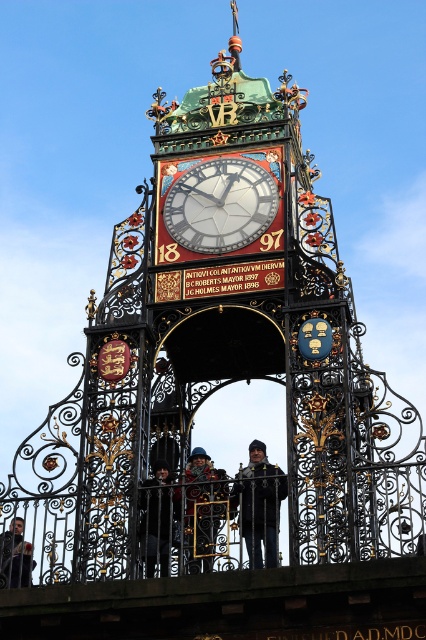
What is the relationship between the size of the wrought iron gate at center and the dark blue fabric jacket at center?

The wrought iron gate at center is wider than the dark blue fabric jacket at center.

You are a visitor standing in front of the Eastgate Clock and want to take a photo of the wrought iron gate at center and the dark blue fabric jacket at center. Which object is taller?

The wrought iron gate at center is taller than the dark blue fabric jacket at center.

You are standing in front of the Eastgate Clock and need to take a photo of the wrought iron gate at center and the dark gray jacket at lower left. Which object should you focus on first to ensure both are in the frame without moving the camera?

The wrought iron gate at center is bigger than the dark gray jacket at lower left, so you should focus on the wrought iron gate at center first to ensure both are in the frame without moving the camera.